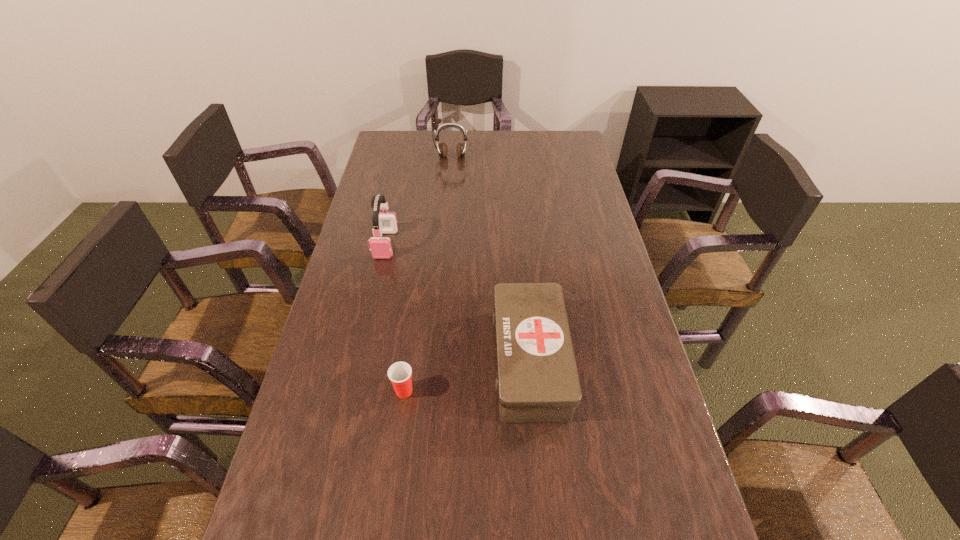
This screenshot has width=960, height=540. In order to click on vacant space located on the right of the shortest object in this screenshot , I will do `click(521, 392)`.

The height and width of the screenshot is (540, 960). Identify the location of object present at the far edge. (461, 147).

Where is `object present at the left edge`? object present at the left edge is located at coordinates (383, 223).

Locate an element on the screen. This screenshot has height=540, width=960. vacant space at the far edge of the desktop is located at coordinates (451, 149).

At what (x,y) coordinates should I click in order to perform the action: click on blank space at the left edge of the desktop. Please return your answer as a coordinate pair (x, y). This screenshot has height=540, width=960. Looking at the image, I should click on (351, 456).

Where is `vacant space at the right edge of the desktop`? The height and width of the screenshot is (540, 960). vacant space at the right edge of the desktop is located at coordinates (608, 237).

Find the location of a particular element. The height and width of the screenshot is (540, 960). free space at the far right corner of the desktop is located at coordinates (543, 136).

Locate an element on the screen. Image resolution: width=960 pixels, height=540 pixels. free space between the first-aid kit and the right earphone is located at coordinates (491, 259).

At what (x,y) coordinates should I click in order to perform the action: click on vacant point located between the farthest object and the third tallest object. Please return your answer as a coordinate pair (x, y). The height and width of the screenshot is (540, 960). Looking at the image, I should click on (491, 259).

In order to click on unoccupied position between the first-aid kit and the left earphone in this screenshot , I will do `click(458, 302)`.